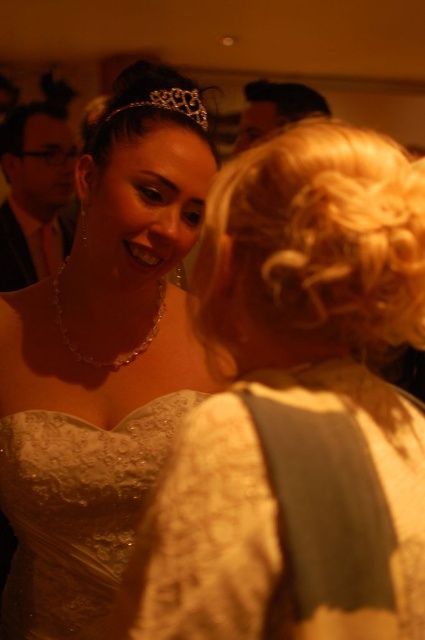
You are standing in the center of the room and want to walk towards the lace fabric dress at center. Which direction should you move in order to reach it?

The lace fabric dress at center is located at point 0.800 on the x axis and 0.181 on the y axis. Since you are at the center of the room, you should move towards the right and slightly downward to reach it.

You are a photographer at a wedding and need to adjust the lighting to ensure both the lace dress at upper left and the matte black suit at left are well lit. Since the lace dress is more reflective, which object might require more careful adjustment to avoid overexposure?

The lace dress at upper left is larger in size than the matte black suit at left, so it might require more careful adjustment to avoid overexposure due to its larger reflective surface area.

You are a photographer at a wedding and need to adjust the lighting to ensure both the lace fabric dress at center and the matte black hair at upper center are well illuminated. Considering their heights, which object should be positioned closer to the light source to ensure proper exposure?

The lace fabric dress at center is taller than the matte black hair at upper center. To ensure proper exposure, the matte black hair at upper center should be positioned closer to the light source since it is shorter and requires less distance for adequate illumination.